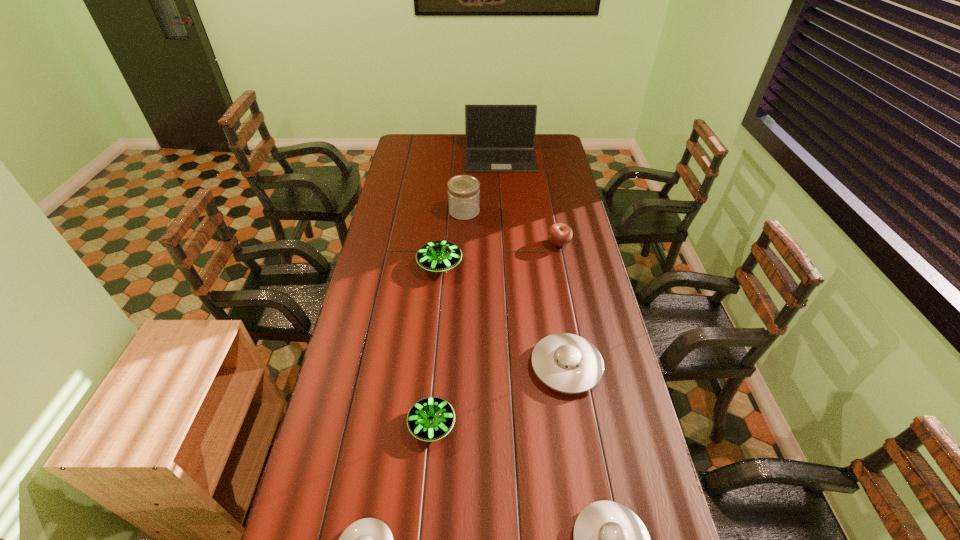
The height and width of the screenshot is (540, 960). Find the location of `the nearer green saucer`. the nearer green saucer is located at coordinates (430, 419).

You are a GUI agent. You are given a task and a screenshot of the screen. Output one action in this format:
    pyautogui.click(x=<x>, y=<y>)
    Task: Click on the vacant position located on the screen of the farthest object
    
    Given the screenshot: What is the action you would take?
    pyautogui.click(x=505, y=219)

At what (x,y) coordinates should I click in order to perform the action: click on vacant area situated on the front of the second farthest object. Please return your answer as a coordinate pair (x, y). The width and height of the screenshot is (960, 540). Looking at the image, I should click on point(463,245).

I want to click on free space located on the front of the farthest saucer, so click(x=435, y=312).

The width and height of the screenshot is (960, 540). In order to click on vacant space located on the side of the apple with the unique marking in this screenshot , I will do click(525, 244).

This screenshot has width=960, height=540. I want to click on vacant region located on the side of the apple with the unique marking, so click(516, 244).

Locate an element on the screen. The height and width of the screenshot is (540, 960). free location located 0.160m on the side of the apple with the unique marking is located at coordinates (509, 244).

Locate an element on the screen. vacant space located 0.190m on the front of the biggest gray saucer is located at coordinates (582, 460).

You are a GUI agent. You are given a task and a screenshot of the screen. Output one action in this format:
    pyautogui.click(x=<x>, y=<y>)
    Task: Click on the vacant area located 0.090m on the back of the sixth farthest object
    
    Given the screenshot: What is the action you would take?
    pyautogui.click(x=436, y=377)

This screenshot has width=960, height=540. I want to click on object located at the far edge, so click(499, 138).